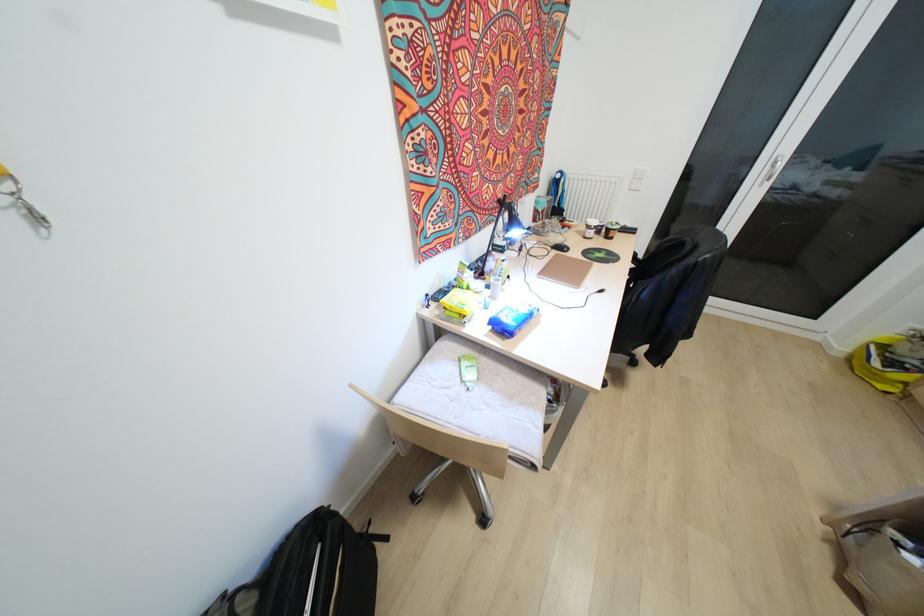
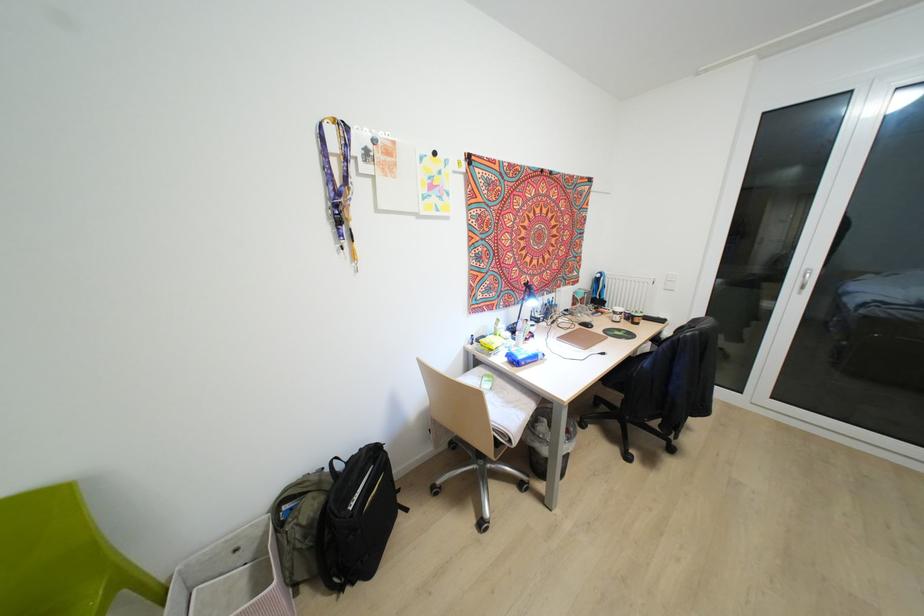
Where in the second image is the point corresponding to (611,238) from the first image?

(637, 323)